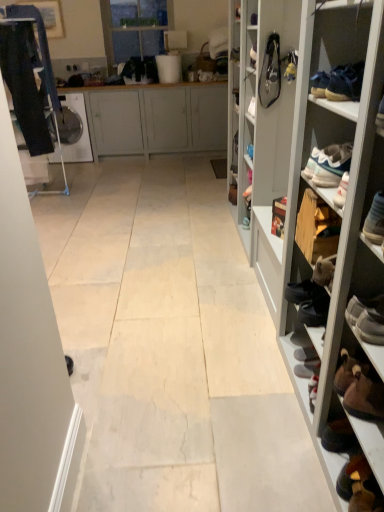
Question: Can you confirm if matte gray cabinet at center is shorter than wooden shoe rack at right?

Choices:
 (A) no
 (B) yes

Answer: (B)

Question: From a real-world perspective, is matte gray cabinet at center beneath wooden shoe rack at right?

Choices:
 (A) no
 (B) yes

Answer: (B)

Question: Are matte gray cabinet at center and wooden shoe rack at right located far from each other?

Choices:
 (A) no
 (B) yes

Answer: (B)

Question: Considering the relative positions of matte gray cabinet at center and wooden shoe rack at right in the image provided, is matte gray cabinet at center to the left of wooden shoe rack at right from the viewer's perspective?

Choices:
 (A) no
 (B) yes

Answer: (B)

Question: Is matte gray cabinet at center further to camera compared to wooden shoe rack at right?

Choices:
 (A) no
 (B) yes

Answer: (B)

Question: Can you confirm if matte gray cabinet at center is wider than wooden shoe rack at right?

Choices:
 (A) no
 (B) yes

Answer: (B)

Question: Does leather bag at upper right, marked as the second shoe in a right-to-left arrangement, have a lesser width compared to transparent glass door at upper center?

Choices:
 (A) no
 (B) yes

Answer: (B)

Question: Can you confirm if leather bag at upper right, marked as the second shoe in a right-to-left arrangement, is shorter than transparent glass door at upper center?

Choices:
 (A) no
 (B) yes

Answer: (B)

Question: From a real-world perspective, is leather bag at upper right, marked as the second shoe in a right-to-left arrangement, over transparent glass door at upper center?

Choices:
 (A) yes
 (B) no

Answer: (B)

Question: Does leather bag at upper right, acting as the first shoe starting from the left, appear on the left side of transparent glass door at upper center?

Choices:
 (A) no
 (B) yes

Answer: (A)

Question: Would you say leather bag at upper right, marked as the second shoe in a right-to-left arrangement, is outside transparent glass door at upper center?

Choices:
 (A) yes
 (B) no

Answer: (A)

Question: Does transparent glass door at upper center lie behind leather bag at upper right, marked as the second shoe in a right-to-left arrangement?

Choices:
 (A) yes
 (B) no

Answer: (A)